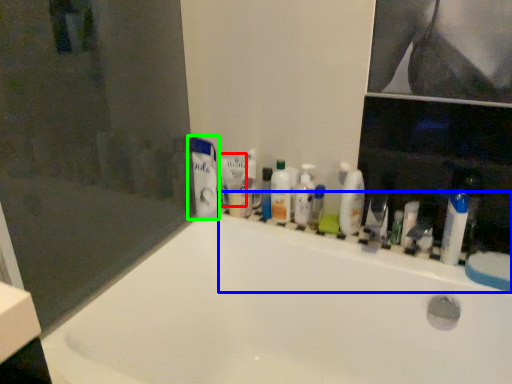
Question: Considering the real-world distances, which object is farthest from toothpaste (highlighted by a red box)? ledge (highlighted by a blue box) or toothpaste (highlighted by a green box)?

Choices:
 (A) ledge
 (B) toothpaste

Answer: (A)